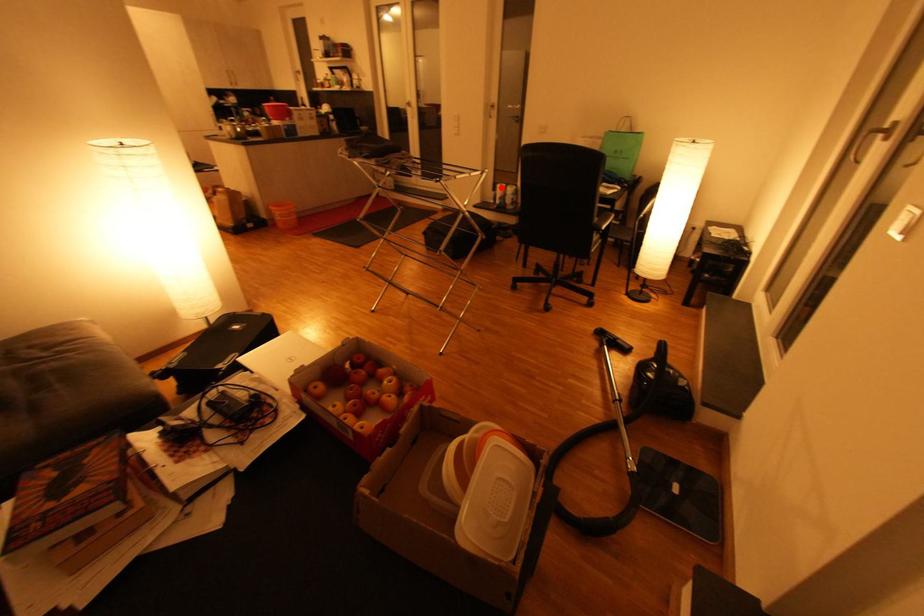
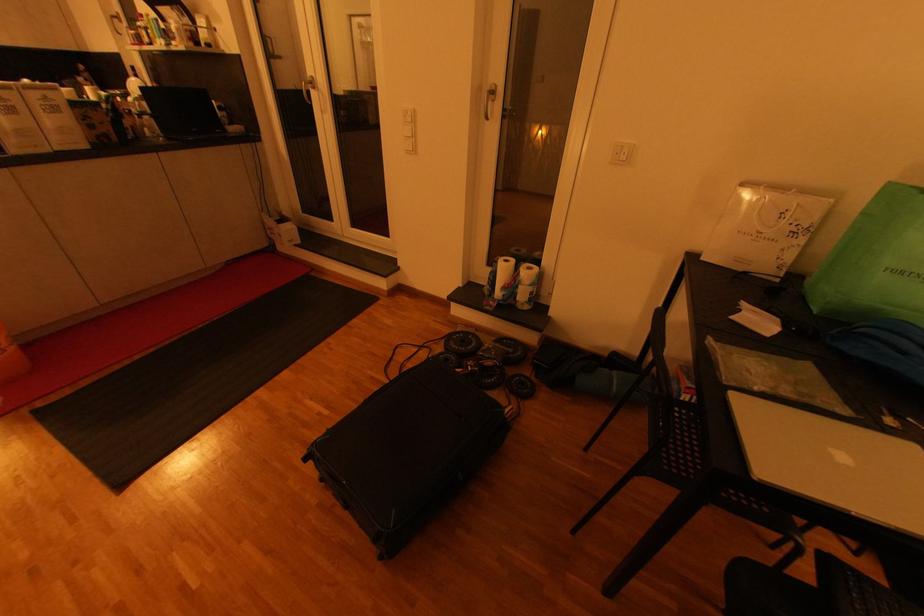
Question: I am providing you with two images of the same scene from different viewpoints. In image1, a red point is highlighted. Considering the same 3D point in image2, which of the following is correct?

Choices:
 (A) It is closer
 (B) It is farther

Answer: (B)